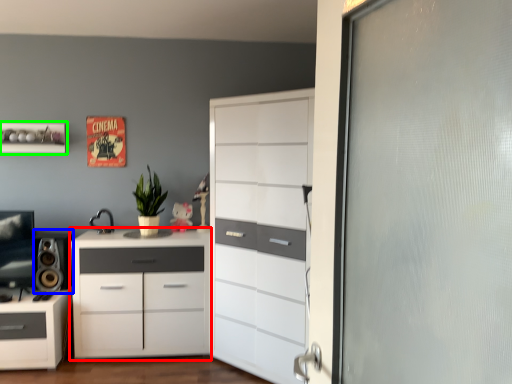
Question: Estimate the real-world distances between objects in this image. Which object is closer to chest of drawers (highlighted by a red box), speaker (highlighted by a blue box) or shelf (highlighted by a green box)?

Choices:
 (A) speaker
 (B) shelf

Answer: (A)